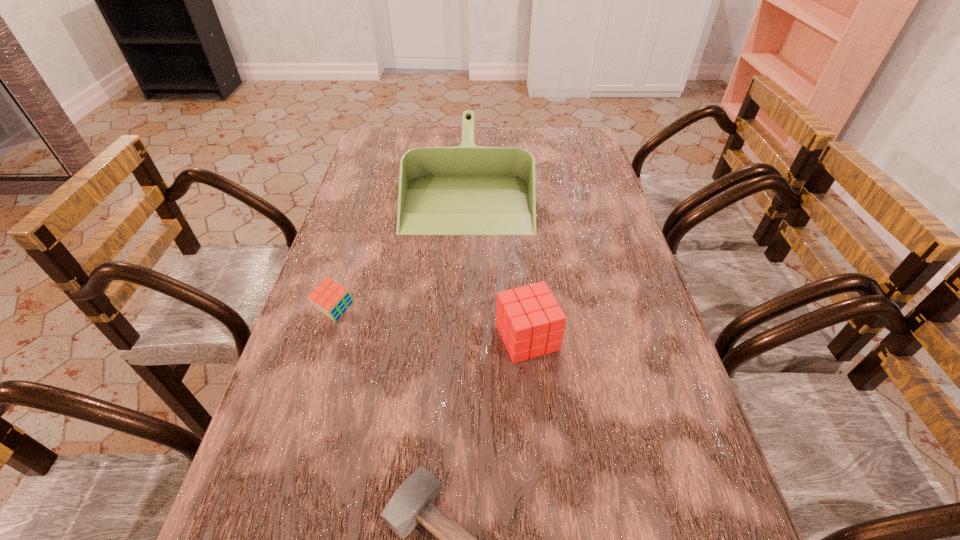
This screenshot has height=540, width=960. In order to click on object at the far left corner in this screenshot , I will do `click(463, 190)`.

Image resolution: width=960 pixels, height=540 pixels. I want to click on vacant space at the far edge, so click(431, 134).

In the image, there is a desktop. Identify the location of vacant region at the left edge. (338, 321).

This screenshot has height=540, width=960. I want to click on vacant area at the right edge, so (x=590, y=200).

This screenshot has height=540, width=960. In order to click on vacant region at the far left corner of the desktop in this screenshot , I will do `click(396, 130)`.

The width and height of the screenshot is (960, 540). Find the location of `vacant space at the far right corner of the desktop`. vacant space at the far right corner of the desktop is located at coordinates (585, 143).

Where is `free space between the taller cube and the leftmost object`? This screenshot has width=960, height=540. free space between the taller cube and the leftmost object is located at coordinates (431, 325).

The width and height of the screenshot is (960, 540). In order to click on vacant point located between the leftmost object and the dustpan in this screenshot , I will do `click(402, 247)`.

Identify the location of unoccupied position between the taller cube and the left cube. (431, 325).

At what (x,y) coordinates should I click in order to perform the action: click on object that is the third closest one to the right cube. Please return your answer as a coordinate pair (x, y). This screenshot has width=960, height=540. Looking at the image, I should click on click(329, 297).